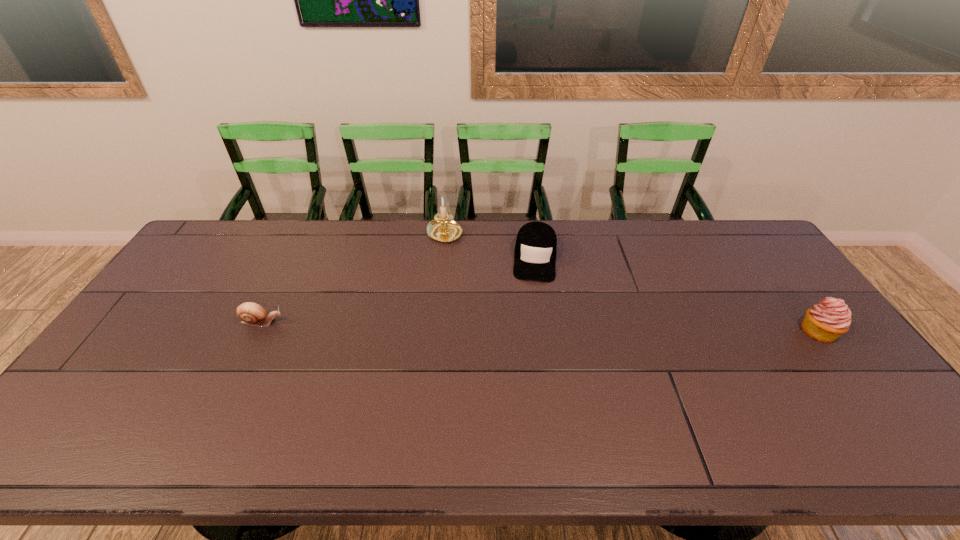
Identify the location of free space on the desktop that is between the shortest object and the second tallest object and is positioned on the front-facing side of the cap. The height and width of the screenshot is (540, 960). (530, 327).

Identify the location of vacant spot on the desktop that is between the leftmost object and the third shortest object and is positioned on the handle side of the tallest object. The height and width of the screenshot is (540, 960). (508, 327).